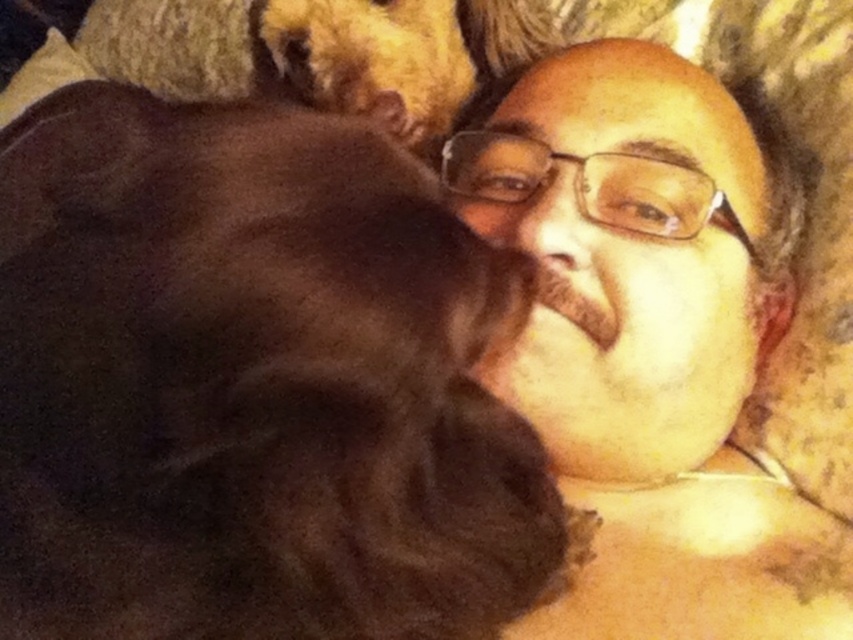
Question: Does brown fur dog at center appear on the right side of golden fur dog at upper center?

Choices:
 (A) no
 (B) yes

Answer: (A)

Question: Among these points, which one is nearest to the camera?

Choices:
 (A) (543, 128)
 (B) (103, 531)

Answer: (B)

Question: Which point appears farthest from the camera in this image?

Choices:
 (A) (489, 44)
 (B) (503, 540)
 (C) (549, 348)

Answer: (A)

Question: Which object is positioned farthest from the golden fur dog at upper center?

Choices:
 (A) brown fur dog at center
 (B) smooth skin face at center

Answer: (A)

Question: Can you confirm if smooth skin face at center is wider than golden fur dog at upper center?

Choices:
 (A) yes
 (B) no

Answer: (A)

Question: Does brown fur dog at center appear under smooth skin face at center?

Choices:
 (A) no
 (B) yes

Answer: (B)